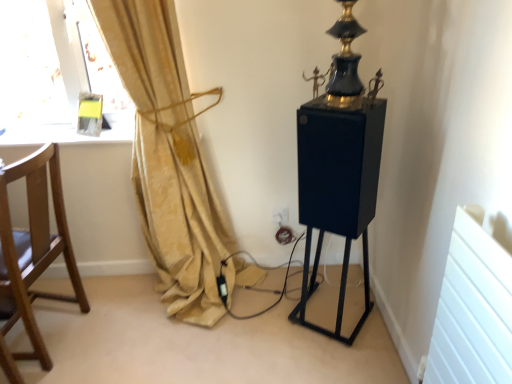
I want to click on vacant space underneath wooden chair at left (from a real-world perspective), so click(x=50, y=330).